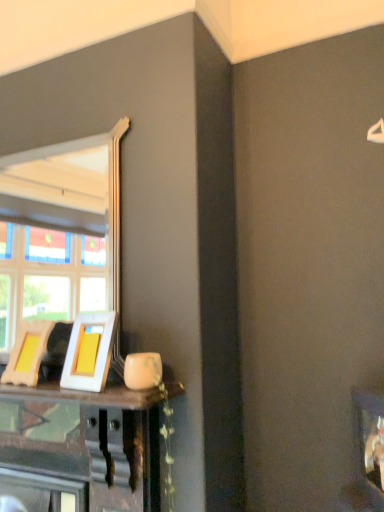
Question: From a real-world perspective, is white glossy picture frame at center, the second picture frame viewed from the left, physically below wooden picture frame at lower left, the 1th picture frame from the left?

Choices:
 (A) no
 (B) yes

Answer: (A)

Question: Is white glossy picture frame at center, the second picture frame viewed from the left, aimed at wooden picture frame at lower left, the 1th picture frame from the left?

Choices:
 (A) yes
 (B) no

Answer: (B)

Question: Is white glossy picture frame at center, the second picture frame viewed from the left, turned away from wooden picture frame at lower left, the second picture frame in the right-to-left sequence?

Choices:
 (A) no
 (B) yes

Answer: (A)

Question: Is white glossy picture frame at center, the 1th picture frame from the right, positioned in front of wooden picture frame at lower left, the 1th picture frame from the left?

Choices:
 (A) no
 (B) yes

Answer: (B)

Question: Is white glossy picture frame at center, the second picture frame viewed from the left, far from wooden picture frame at lower left, the second picture frame in the right-to-left sequence?

Choices:
 (A) yes
 (B) no

Answer: (B)

Question: Is white glossy picture frame at center, the 1th picture frame from the right, not within wooden picture frame at lower left, the second picture frame in the right-to-left sequence?

Choices:
 (A) yes
 (B) no

Answer: (A)

Question: Is wooden picture frame at lower left, the second picture frame in the right-to-left sequence, closer to camera compared to white glossy picture frame at center, the second picture frame viewed from the left?

Choices:
 (A) yes
 (B) no

Answer: (B)

Question: Does wooden picture frame at lower left, the 1th picture frame from the left, contain white glossy picture frame at center, the 1th picture frame from the right?

Choices:
 (A) yes
 (B) no

Answer: (B)

Question: Is wooden picture frame at lower left, the 1th picture frame from the left, to the right of white glossy picture frame at center, the 1th picture frame from the right, from the viewer's perspective?

Choices:
 (A) no
 (B) yes

Answer: (A)

Question: Does wooden picture frame at lower left, the second picture frame in the right-to-left sequence, have a greater width compared to white glossy picture frame at center, the 1th picture frame from the right?

Choices:
 (A) yes
 (B) no

Answer: (B)

Question: From a real-world perspective, is wooden picture frame at lower left, the 1th picture frame from the left, below white glossy picture frame at center, the 1th picture frame from the right?

Choices:
 (A) yes
 (B) no

Answer: (A)

Question: Does wooden picture frame at lower left, the second picture frame in the right-to-left sequence, have a smaller size compared to white glossy picture frame at center, the 1th picture frame from the right?

Choices:
 (A) yes
 (B) no

Answer: (A)

Question: Considering the positions of white glossy picture frame at center, the second picture frame viewed from the left, and wooden picture frame at lower left, the 1th picture frame from the left, in the image, is white glossy picture frame at center, the second picture frame viewed from the left, bigger or smaller than wooden picture frame at lower left, the 1th picture frame from the left,?

Choices:
 (A) big
 (B) small

Answer: (A)